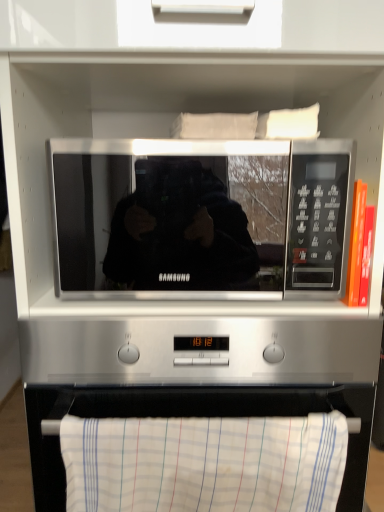
Identify the location of blank space situated above white striped towel at lower center (from a real-world perspective). This screenshot has width=384, height=512. (215, 417).